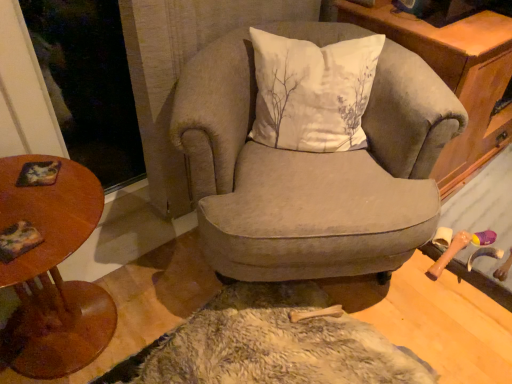
Image resolution: width=512 pixels, height=384 pixels. What do you see at coordinates (455, 77) in the screenshot? I see `wooden cabinet at upper right` at bounding box center [455, 77].

What is the approximate width of white cotton cushion at center?

white cotton cushion at center is 30.08 centimeters in width.

Image resolution: width=512 pixels, height=384 pixels. In order to click on white cotton cushion at center in this screenshot , I will do `click(312, 92)`.

This screenshot has width=512, height=384. Find the location of `velvet gray armchair at center`. velvet gray armchair at center is located at coordinates (311, 171).

Which is behind, point (27, 177) or point (390, 5)?

The point (390, 5) is more distant.

In the scene shown: Is wooden round table at left not within wooden cabinet at upper right?

Yes, wooden round table at left is not within wooden cabinet at upper right.

How different are the orientations of wooden round table at left and wooden cabinet at upper right in degrees?

The angular difference between wooden round table at left and wooden cabinet at upper right is 93.7 degrees.

Does point (373, 42) come behind point (393, 129)?

Yes, point (373, 42) is farther from viewer.

Between white cotton cushion at center and velvet gray armchair at center, which one has smaller size?

white cotton cushion at center is smaller.

From the image's perspective, is white cotton cushion at center under velvet gray armchair at center?

Incorrect, from the image's perspective, white cotton cushion at center is higher than velvet gray armchair at center.

Is velvet gray armchair at center a part of white cotton cushion at center?

No, velvet gray armchair at center is located outside of white cotton cushion at center.

Is white cotton cushion at center looking in the opposite direction of wooden cabinet at upper right?

No, white cotton cushion at center is not facing the opposite direction of wooden cabinet at upper right.

From the image's perspective, who appears lower, white cotton cushion at center or wooden cabinet at upper right?

white cotton cushion at center appears lower in the image.

Considering the points (344, 63) and (496, 17), which point is in front, point (344, 63) or point (496, 17)?

Point (344, 63)

Locate an element on the screen. This screenshot has height=384, width=512. pillow on the left side of wooden cabinet at upper right is located at coordinates (312, 92).

In the scene shown: Can you confirm if wooden cabinet at upper right is taller than velvet gray armchair at center?

Yes.

From a real-world perspective, between wooden cabinet at upper right and velvet gray armchair at center, who is vertically lower?

From a 3D spatial view, velvet gray armchair at center is below.

Is wooden cabinet at upper right looking in the opposite direction of velvet gray armchair at center?

wooden cabinet at upper right does not have its back to velvet gray armchair at center.

In the scene shown: Does wooden cabinet at upper right have a smaller size compared to velvet gray armchair at center?

No.

From a real-world perspective, is wooden round table at left physically above velvet gray armchair at center?

Incorrect, from a real-world perspective, wooden round table at left is lower than velvet gray armchair at center.

Is point (64, 323) positioned behind point (332, 193)?

Yes.

Which object is further away from the camera, wooden round table at left or velvet gray armchair at center?

velvet gray armchair at center is behind.

From the image's perspective, is wooden round table at left located beneath velvet gray armchair at center?

Correct, wooden round table at left appears lower than velvet gray armchair at center in the image.

Is white cotton cushion at center not within wooden round table at left?

Absolutely, white cotton cushion at center is external to wooden round table at left.

Can you confirm if white cotton cushion at center is smaller than wooden round table at left?

Correct, white cotton cushion at center occupies less space than wooden round table at left.

Locate an element on the screen. This screenshot has width=512, height=384. pillow lying behind the wooden round table at left is located at coordinates (312, 92).

Is white cotton cushion at center looking in the opposite direction of wooden round table at left?

white cotton cushion at center does not have its back to wooden round table at left.

Which is more to the left, velvet gray armchair at center or white cotton cushion at center?

velvet gray armchair at center.

From the image's perspective, is velvet gray armchair at center positioned above or below white cotton cushion at center?

velvet gray armchair at center is below white cotton cushion at center.

Is velvet gray armchair at center taller than white cotton cushion at center?

Yes, velvet gray armchair at center is taller than white cotton cushion at center.

Is white cotton cushion at center a part of velvet gray armchair at center?

That's correct, white cotton cushion at center is inside velvet gray armchair at center.

I want to click on cabinetry to the right of wooden round table at left, so 455,77.

Where is `chair that is below the white cotton cushion at center (from the image's perspective)`? The height and width of the screenshot is (384, 512). chair that is below the white cotton cushion at center (from the image's perspective) is located at coordinates (311, 171).

From the image, which object appears to be farther from wooden cabinet at upper right, velvet gray armchair at center or white cotton cushion at center?

velvet gray armchair at center is positioned further to the anchor wooden cabinet at upper right.

Looking at the image, which one is located closer to wooden round table at left, velvet gray armchair at center or wooden cabinet at upper right?

velvet gray armchair at center lies closer to wooden round table at left than the other object.

In the scene shown: Looking at the image, which one is located closer to wooden round table at left, velvet gray armchair at center or white cotton cushion at center?

velvet gray armchair at center.

Looking at the image, which one is located further to wooden round table at left, white cotton cushion at center or wooden cabinet at upper right?

wooden cabinet at upper right.

Looking at the image, which one is located further to wooden cabinet at upper right, white cotton cushion at center or velvet gray armchair at center?

Among the two, velvet gray armchair at center is located further to wooden cabinet at upper right.

When comparing their distances from wooden cabinet at upper right, does white cotton cushion at center or wooden round table at left seem closer?

white cotton cushion at center is positioned closer to the anchor wooden cabinet at upper right.

Which object lies nearer to the anchor point velvet gray armchair at center, white cotton cushion at center or wooden round table at left?

Among the two, white cotton cushion at center is located nearer to velvet gray armchair at center.

Considering their positions, is wooden round table at left positioned closer to velvet gray armchair at center than wooden cabinet at upper right?

wooden cabinet at upper right.

Identify the location of pillow between velvet gray armchair at center and wooden cabinet at upper right in the horizontal direction. The image size is (512, 384). (312, 92).

Locate an element on the screen. pillow situated between wooden round table at left and wooden cabinet at upper right from left to right is located at coordinates (312, 92).

Find the location of a particular element. The image size is (512, 384). chair situated between wooden round table at left and wooden cabinet at upper right from left to right is located at coordinates (311, 171).

Find the location of a particular element. The width and height of the screenshot is (512, 384). chair between wooden round table at left and white cotton cushion at center is located at coordinates (311, 171).